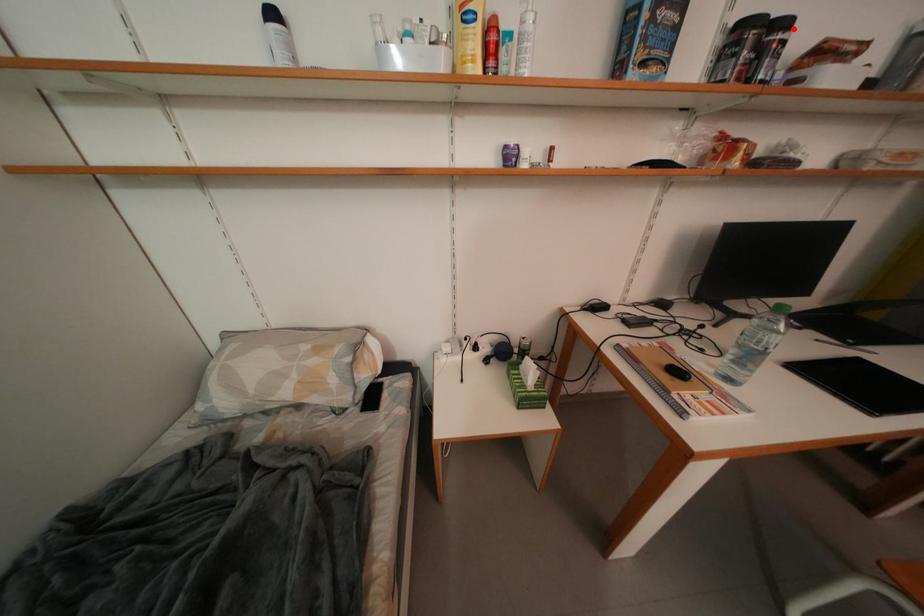
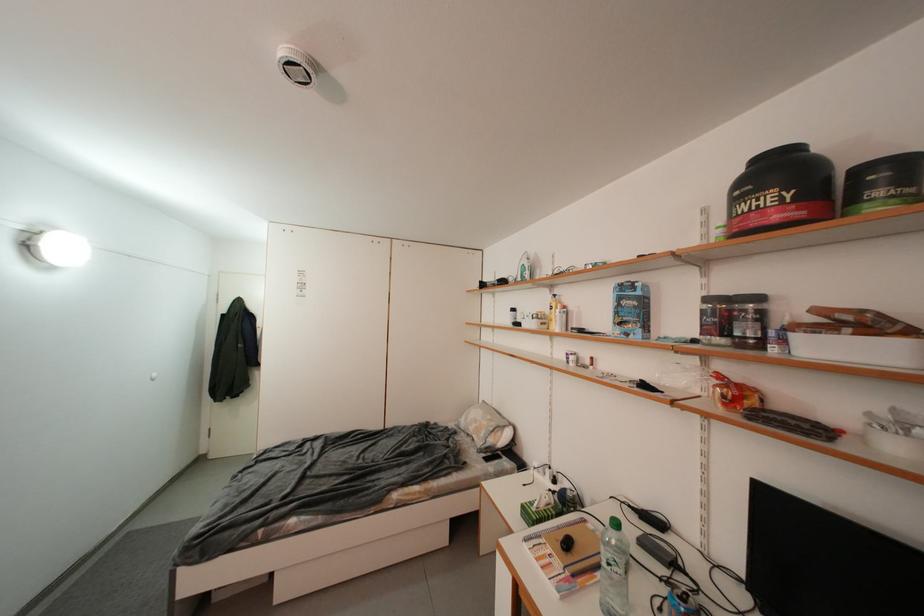
Question: A red point is marked in image1. In image2, is the corresponding 3D point closer to the camera or farther? Reply with the corresponding letter.

Choices:
 (A) The corresponding 3D point is closer.
 (B) The corresponding 3D point is farther.

Answer: (A)